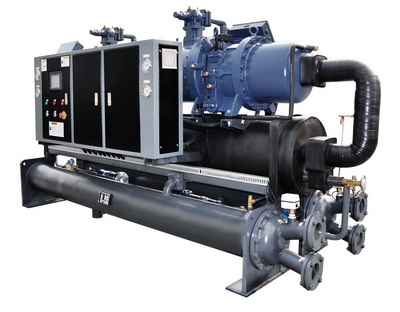
Identify the location of right door of cabinet on large mechanical device. (126, 111).